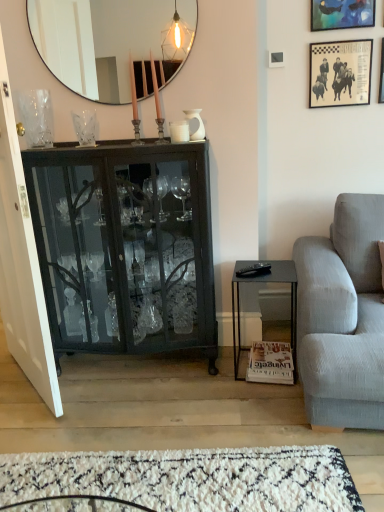
Question: From a real-world perspective, is clear glass vase at upper center, acting as the second vase starting from the left, located beneath metallic blue painting at upper right, the first picture frame when ordered from left to right?

Choices:
 (A) yes
 (B) no

Answer: (A)

Question: From the image's perspective, is clear glass vase at upper center, the 2th vase when ordered from right to left, located beneath metallic blue painting at upper right, acting as the third picture frame starting from the right?

Choices:
 (A) yes
 (B) no

Answer: (A)

Question: Is clear glass vase at upper center, the 2th vase when ordered from right to left, oriented towards metallic blue painting at upper right, the first picture frame when ordered from left to right?

Choices:
 (A) yes
 (B) no

Answer: (B)

Question: Is clear glass vase at upper center, the 2th vase when ordered from right to left, placed right next to metallic blue painting at upper right, acting as the third picture frame starting from the right?

Choices:
 (A) yes
 (B) no

Answer: (B)

Question: Is metallic blue painting at upper right, the first picture frame when ordered from left to right, a part of clear glass vase at upper center, acting as the second vase starting from the left?

Choices:
 (A) no
 (B) yes

Answer: (A)

Question: Which is correct: clear glass vase at upper center, acting as the second vase starting from the left, is inside clear glass vase at upper left, placed as the third vase when sorted from right to left, or outside of it?

Choices:
 (A) outside
 (B) inside

Answer: (A)

Question: Is point (84, 130) closer or farther from the camera than point (49, 103)?

Choices:
 (A) closer
 (B) farther

Answer: (A)

Question: Is clear glass vase at upper center, the 2th vase when ordered from right to left, taller or shorter than clear glass vase at upper left, which is the 1th vase in left-to-right order?

Choices:
 (A) short
 (B) tall

Answer: (A)

Question: Considering the positions of clear glass vase at upper center, acting as the second vase starting from the left, and clear glass vase at upper left, placed as the third vase when sorted from right to left, in the image, is clear glass vase at upper center, acting as the second vase starting from the left, wider or thinner than clear glass vase at upper left, placed as the third vase when sorted from right to left,?

Choices:
 (A) thin
 (B) wide

Answer: (A)

Question: Is point (364, 16) positioned closer to the camera than point (203, 509)?

Choices:
 (A) closer
 (B) farther

Answer: (B)

Question: From a real-world perspective, is metallic blue painting at upper right, the first picture frame when ordered from left to right, physically located above or below white shag rug at lower center?

Choices:
 (A) below
 (B) above

Answer: (B)

Question: Is metallic blue painting at upper right, acting as the third picture frame starting from the right, in front of or behind white shag rug at lower center in the image?

Choices:
 (A) front
 (B) behind

Answer: (B)

Question: In terms of height, does metallic blue painting at upper right, the first picture frame when ordered from left to right, look taller or shorter compared to white shag rug at lower center?

Choices:
 (A) short
 (B) tall

Answer: (B)

Question: Is white matte coffee cup at center spatially inside light gray fabric couch at right, or outside of it?

Choices:
 (A) inside
 (B) outside

Answer: (B)

Question: Based on their sizes in the image, would you say white matte coffee cup at center is bigger or smaller than light gray fabric couch at right?

Choices:
 (A) small
 (B) big

Answer: (A)